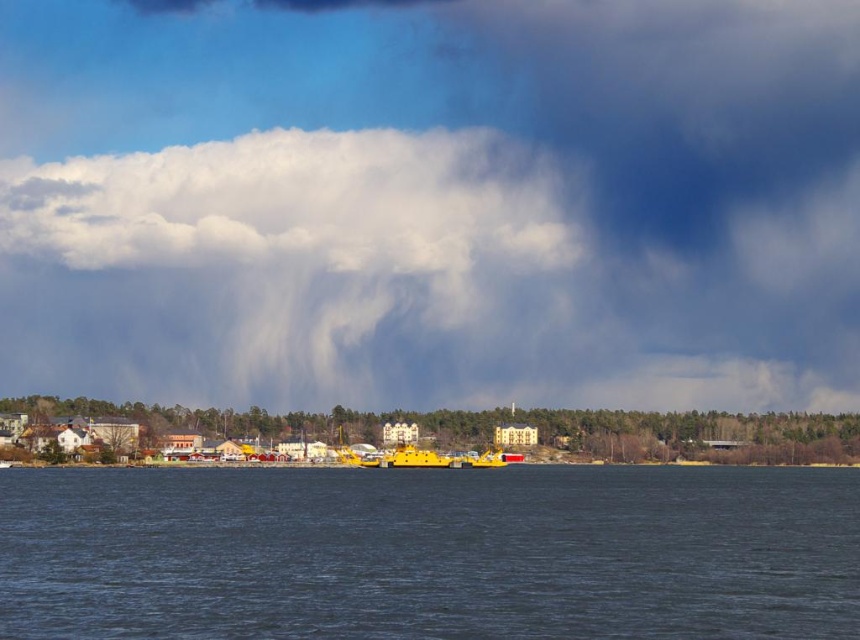
Question: Which object is closer to the camera taking this photo?

Choices:
 (A) cloudy sky at upper center
 (B) yellow rubber boat at center

Answer: (B)

Question: Which object is farther from the camera taking this photo?

Choices:
 (A) cloudy sky at upper center
 (B) yellow rubber boat at center

Answer: (A)

Question: Is cloudy sky at upper center closer to camera compared to yellow rubber boat at center?

Choices:
 (A) no
 (B) yes

Answer: (A)

Question: Does cloudy sky at upper center have a larger size compared to dark blue water at center?

Choices:
 (A) no
 (B) yes

Answer: (B)

Question: Which of these objects is positioned closest to the yellow rubber boat at center?

Choices:
 (A) dark blue water at center
 (B) cloudy sky at upper center

Answer: (A)

Question: Is cloudy sky at upper center wider than yellow rubber boat at center?

Choices:
 (A) no
 (B) yes

Answer: (B)